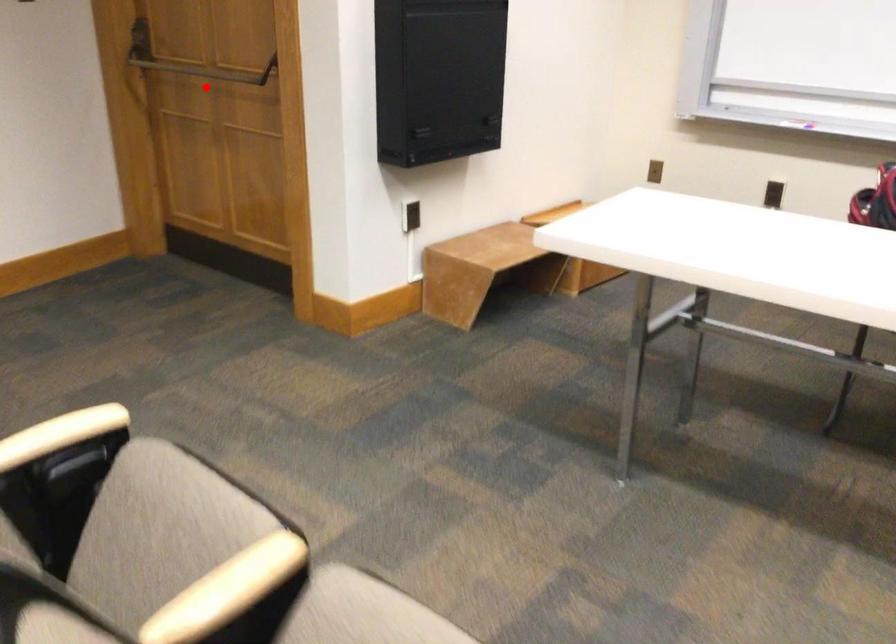
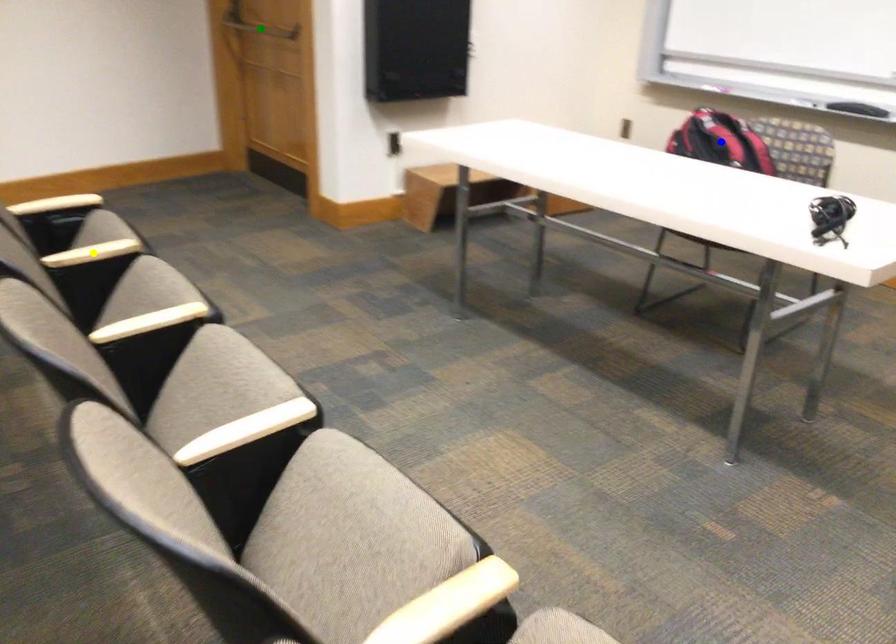
Question: I am providing you with two images of the same scene from different viewpoints. A red point is marked on the first image. You are given multiple points on the second image. Which mark in image 2 goes with the point in image 1?

Choices:
 (A) green point
 (B) blue point
 (C) yellow point

Answer: (A)